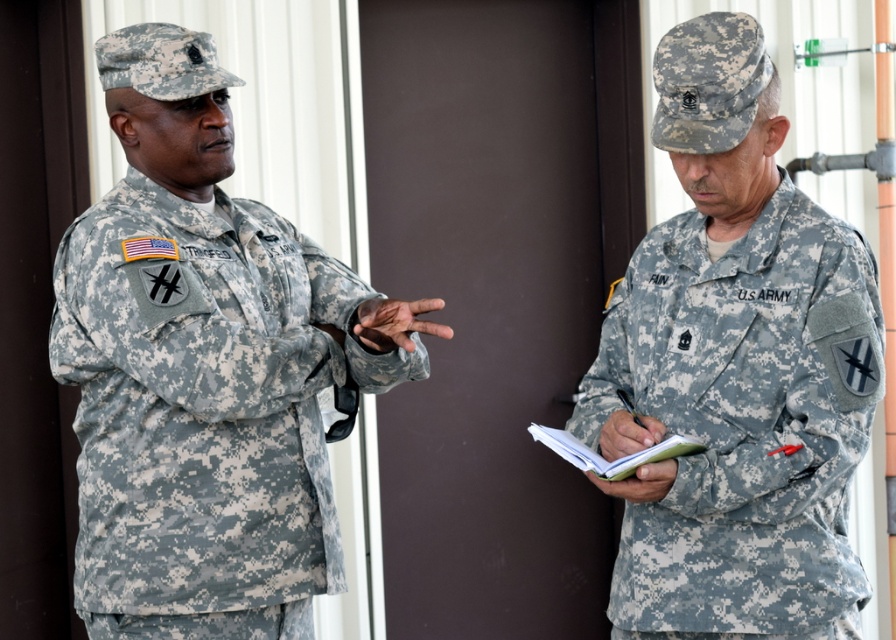
Question: Which of the following is the farthest from the observer?

Choices:
 (A) camouflage fabric uniform at left
 (B) camouflage fabric us army uniform at right

Answer: (A)

Question: Is camouflage fabric uniform at left wider than camouflage fabric us army uniform at right?

Choices:
 (A) no
 (B) yes

Answer: (B)

Question: Is camouflage fabric uniform at left to the left of camouflage fabric us army uniform at right from the viewer's perspective?

Choices:
 (A) yes
 (B) no

Answer: (A)

Question: Among these objects, which one is farthest from the camera?

Choices:
 (A) camouflage fabric us army uniform at right
 (B) camouflage fabric uniform at left

Answer: (B)

Question: Which of the following is the farthest from the observer?

Choices:
 (A) (719, 451)
 (B) (221, 252)

Answer: (B)

Question: In this image, where is camouflage fabric uniform at left located relative to camouflage fabric us army uniform at right?

Choices:
 (A) left
 (B) right

Answer: (A)